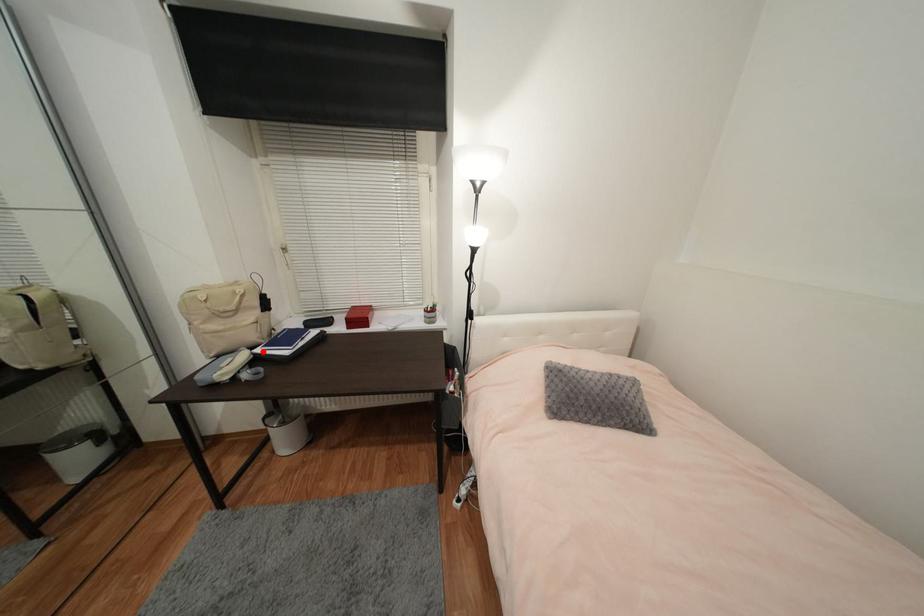
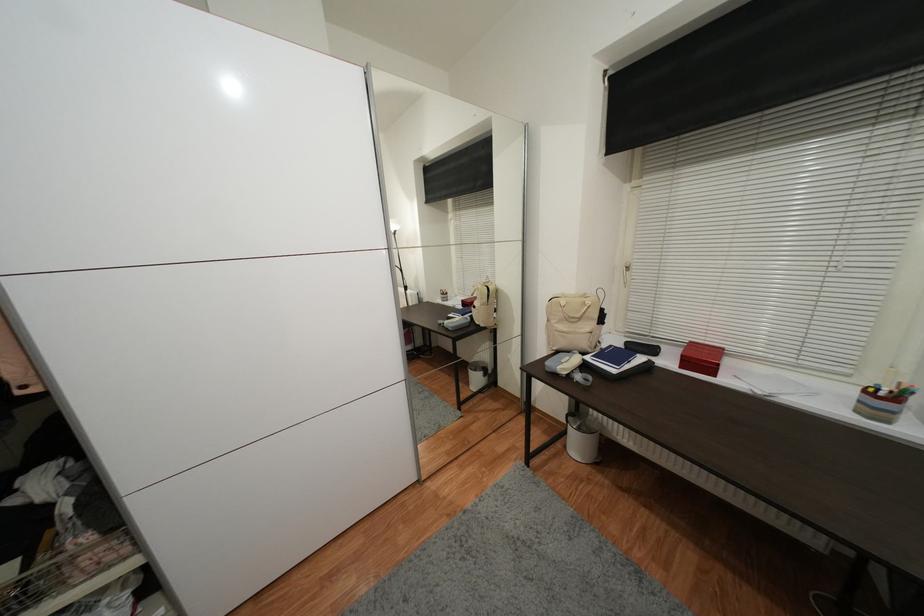
Where in the second image is the point corresponding to the highlighted location from the first image?

(592, 360)